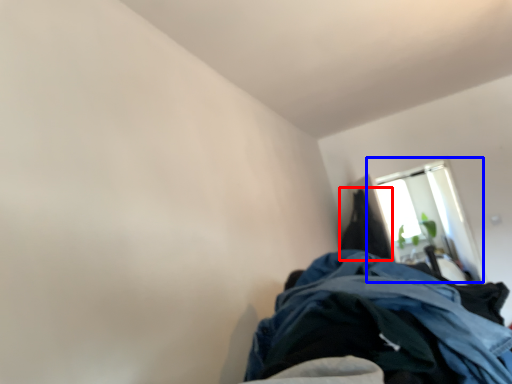
Question: Which point is further to the camera, cloak (highlighted by a red box) or window (highlighted by a blue box)?

Choices:
 (A) cloak
 (B) window

Answer: (B)